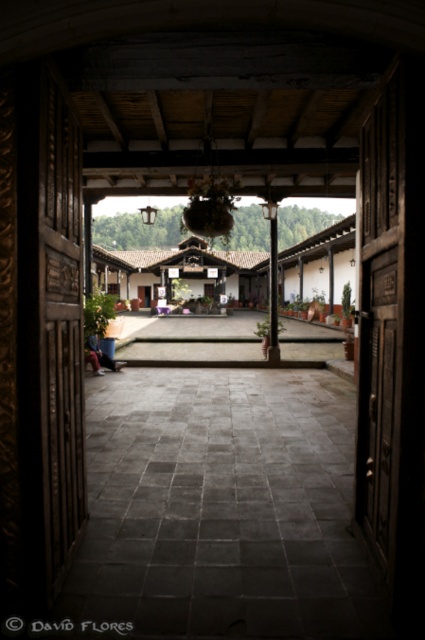
Does dark brown wooden door at left have a lesser height compared to smooth stone pillar at center?

In fact, dark brown wooden door at left may be taller than smooth stone pillar at center.

Does dark brown wooden door at left have a lesser width compared to smooth stone pillar at center?

Correct, dark brown wooden door at left's width is less than smooth stone pillar at center's.

Locate an element on the screen. This screenshot has height=640, width=425. dark brown wooden door at left is located at coordinates (59, 330).